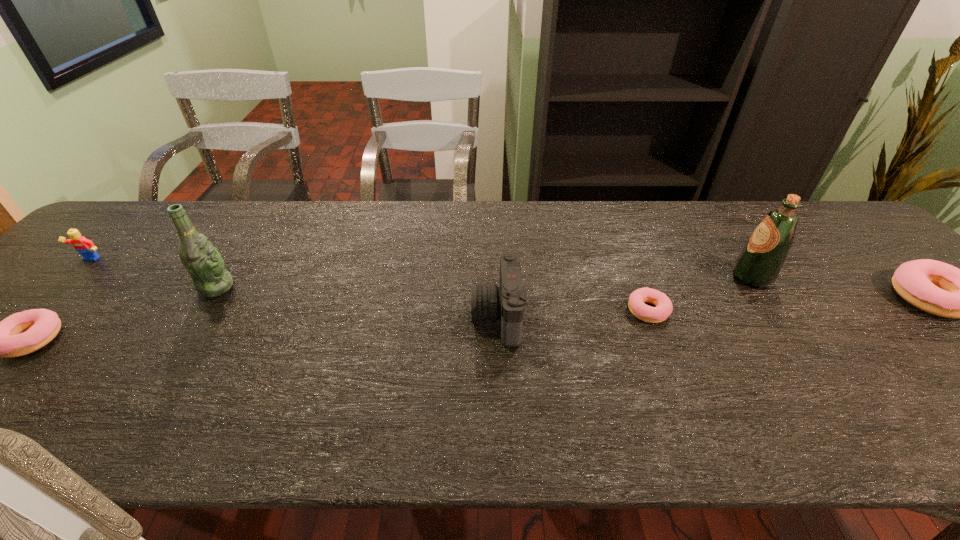
Image resolution: width=960 pixels, height=540 pixels. In order to click on free spot located on the front-facing side of the olive oil in this screenshot , I will do `click(702, 277)`.

Identify the location of free space located on the front-facing side of the olive oil. Image resolution: width=960 pixels, height=540 pixels. (582, 277).

Where is `vacant area situated 0.320m on the surface of the beer bottle`? This screenshot has width=960, height=540. vacant area situated 0.320m on the surface of the beer bottle is located at coordinates (360, 287).

This screenshot has width=960, height=540. Identify the location of free space located 0.050m at the lens of the fourth object from right to left. (451, 316).

Find the location of a particular element. free space located 0.330m at the lens of the fourth object from right to left is located at coordinates (332, 316).

At what (x,y) coordinates should I click in order to perform the action: click on vacant space located 0.280m at the lens of the fourth object from right to left. Please return your answer as a coordinate pair (x, y). This screenshot has height=540, width=960. Looking at the image, I should click on (353, 316).

The image size is (960, 540). What are the coordinates of `object located in the left edge section of the desktop` in the screenshot? It's located at (85, 247).

You are a GUI agent. You are given a task and a screenshot of the screen. Output one action in this format:
    pyautogui.click(x=<x>, y=<y>)
    Task: Click on the free spot at the far edge of the desktop
    The height and width of the screenshot is (540, 960).
    Given the screenshot: What is the action you would take?
    pyautogui.click(x=224, y=215)

The height and width of the screenshot is (540, 960). I want to click on vacant space at the near edge of the desktop, so point(282,380).

This screenshot has width=960, height=540. In the image, there is a desktop. In order to click on free space at the far left corner in this screenshot , I will do `click(139, 246)`.